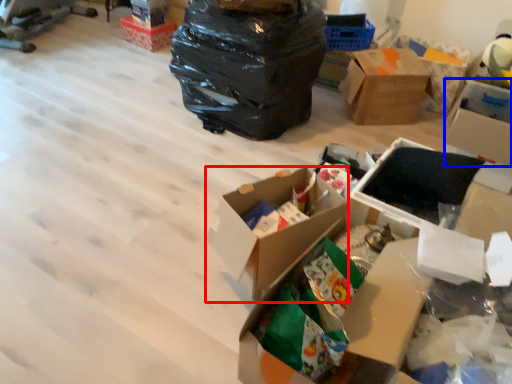
Question: Which object is closer to the camera taking this photo, box (highlighted by a red box) or box (highlighted by a blue box)?

Choices:
 (A) box
 (B) box

Answer: (A)